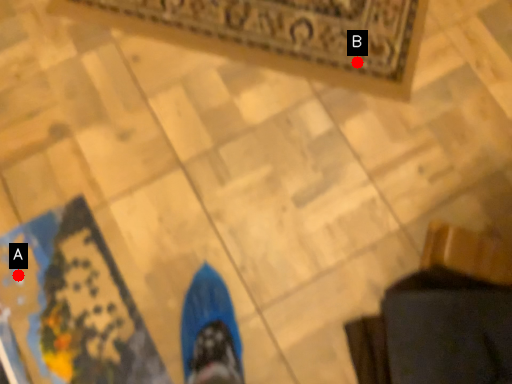
Question: Two points are circled on the image, labeled by A and B beside each circle. Which point appears farthest from the camera in this image?

Choices:
 (A) A is further
 (B) B is further

Answer: (B)